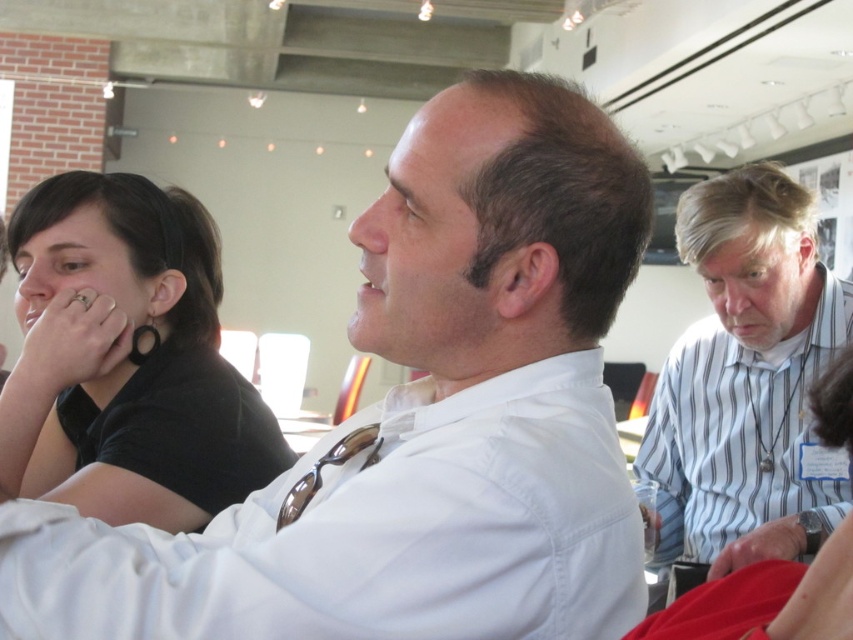
You are an event planner arranging seating for a meeting. You need to place a name tag for the person in the white shirt at center and the person in the black matte shirt at left. Based on their positions in the image, which person should have their name tag placed to the left side of the table?

The black matte shirt at left should have their name tag placed to the left side of the table because the white shirt at center is positioned on the right side of the black matte shirt at left.

You are organizing a photo shoot and need to arrange the two subjects wearing the black matte shirt at left and white striped shirt at right. Based on their current positions, which subject should you position higher in the frame to maintain the original spatial relationship?

The black matte shirt at left should be positioned higher in the frame since it is currently above the white striped shirt at right.